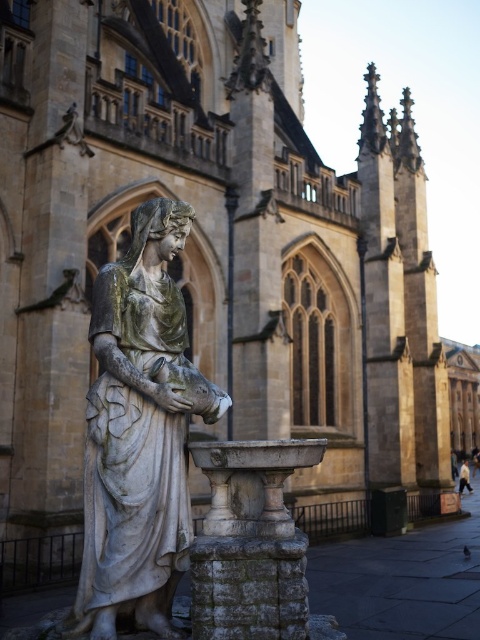
Question: Which of the following is the closest to the observer?

Choices:
 (A) (162, 314)
 (B) (468, 486)

Answer: (A)

Question: Which point is farther from the camera taking this photo?

Choices:
 (A) (171, 417)
 (B) (462, 465)

Answer: (B)

Question: Is stone statue at center above white cotton shirt at center?

Choices:
 (A) no
 (B) yes

Answer: (B)

Question: Is stone statue at center below white cotton shirt at center?

Choices:
 (A) no
 (B) yes

Answer: (A)

Question: From the image, what is the correct spatial relationship of stone statue at center in relation to white cotton shirt at center?

Choices:
 (A) right
 (B) left

Answer: (B)